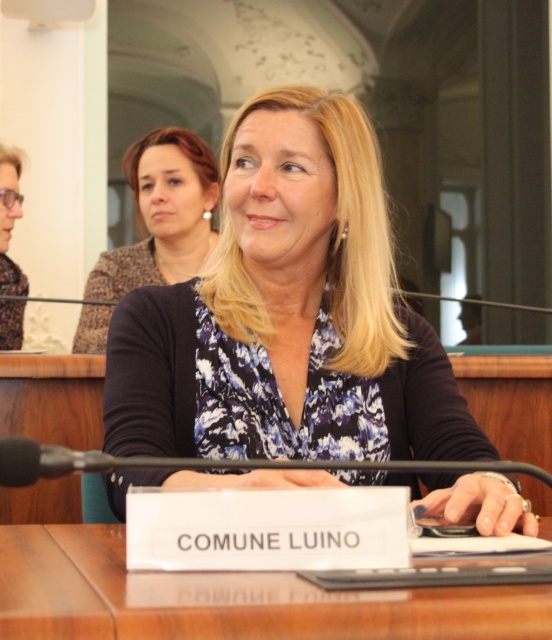
Question: Considering the real-world distances, which object is farthest from the matte black blazer at upper center?

Choices:
 (A) wooden table at center
 (B) matte black glasses at left

Answer: (A)

Question: Is blue floral blouse at center positioned in front of matte black glasses at left?

Choices:
 (A) no
 (B) yes

Answer: (B)

Question: Does matte black blazer at upper center appear on the left side of matte black glasses at left?

Choices:
 (A) yes
 (B) no

Answer: (B)

Question: Estimate the real-world distances between objects in this image. Which object is farther from the blue floral blouse at center?

Choices:
 (A) matte black glasses at left
 (B) matte black blazer at upper center
 (C) wooden table at center

Answer: (A)

Question: Which point is farther to the camera?

Choices:
 (A) (211, 248)
 (B) (245, 148)

Answer: (A)

Question: Does wooden table at center come behind matte black blazer at upper center?

Choices:
 (A) yes
 (B) no

Answer: (B)